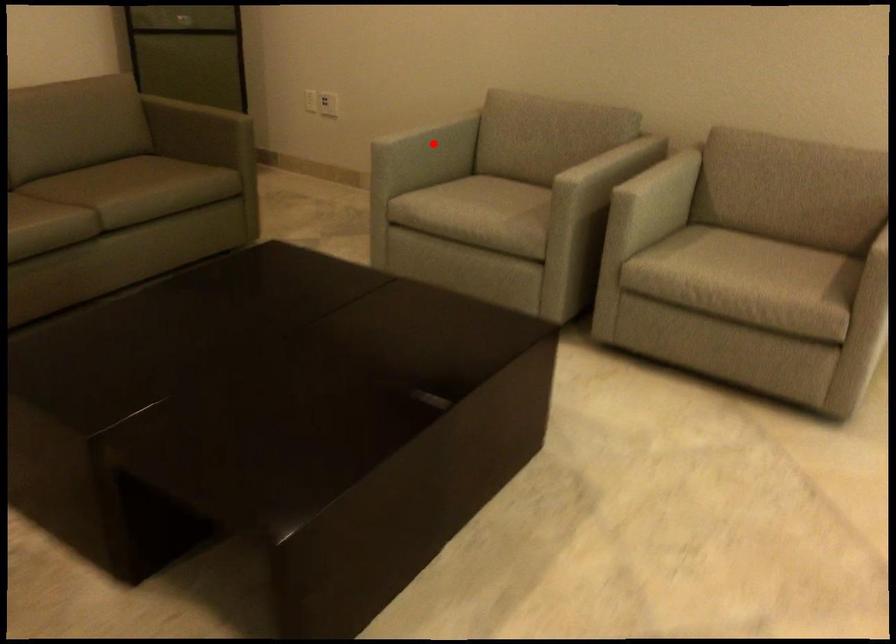
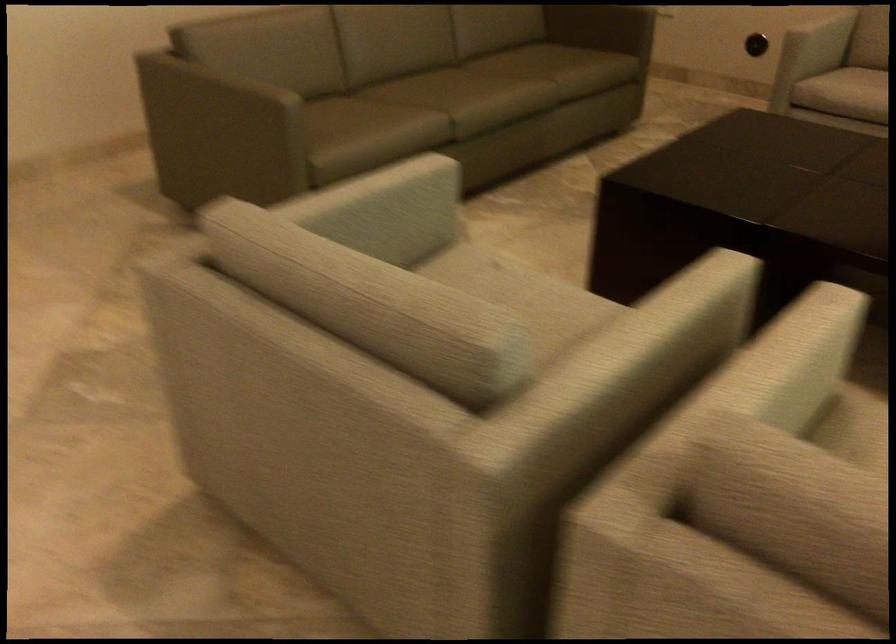
Question: I am providing you with two images of the same scene from different viewpoints. In image1, a red point is highlighted. Considering the same 3D point in image2, which of the following is correct?

Choices:
 (A) It is closer
 (B) It is farther

Answer: (B)